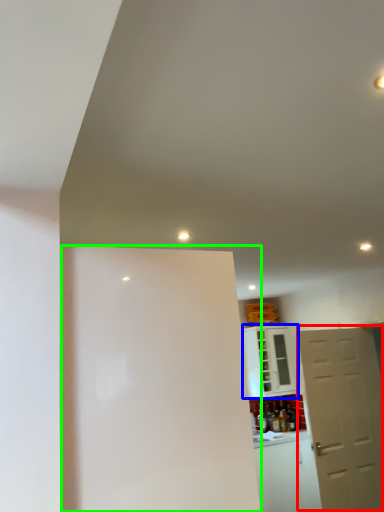
Question: Based on their relative distances, which object is nearer to door (highlighted by a red box)? Choose from cabinetry (highlighted by a blue box) and screen door (highlighted by a green box).

Choices:
 (A) cabinetry
 (B) screen door

Answer: (A)